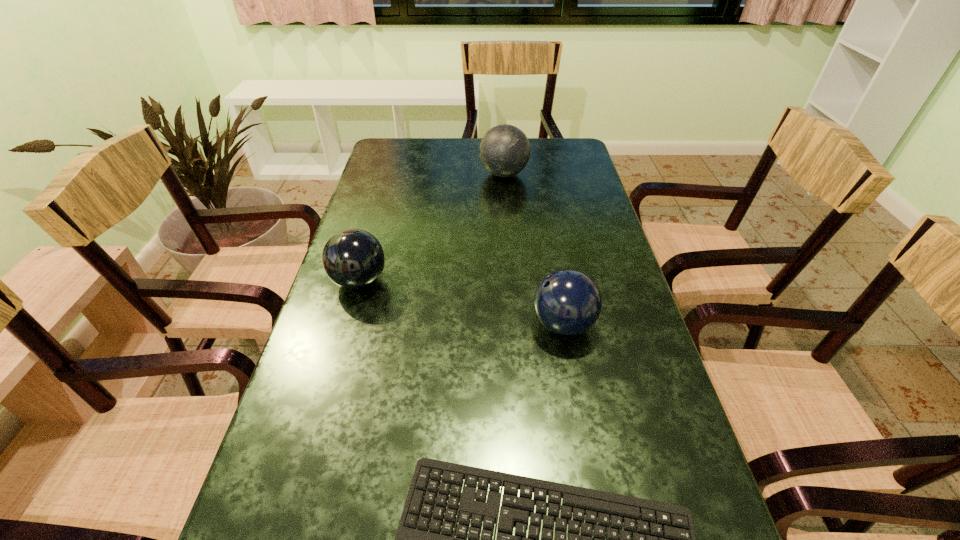
Find the location of a particular element. empty location between the farthest bowling ball and the second nearest object is located at coordinates (534, 249).

In order to click on free space between the farthest bowling ball and the second nearest object in this screenshot , I will do `click(534, 249)`.

At what (x,y) coordinates should I click in order to perform the action: click on vacant area that lies between the leftmost bowling ball and the farthest bowling ball. Please return your answer as a coordinate pair (x, y). Looking at the image, I should click on (432, 227).

You are a GUI agent. You are given a task and a screenshot of the screen. Output one action in this format:
    pyautogui.click(x=<x>, y=<y>)
    Task: Click on the object that can be found as the closest to the farthest bowling ball
    Image resolution: width=960 pixels, height=540 pixels.
    Given the screenshot: What is the action you would take?
    pyautogui.click(x=352, y=258)

Locate an element on the screen. This screenshot has height=540, width=960. the closest object to the nearest bowling ball is located at coordinates point(406,539).

You are a GUI agent. You are given a task and a screenshot of the screen. Output one action in this format:
    pyautogui.click(x=<x>, y=<y>)
    Task: Click on the second closest bowling ball to the farthest object
    The image size is (960, 540).
    Given the screenshot: What is the action you would take?
    pyautogui.click(x=567, y=302)

This screenshot has width=960, height=540. I want to click on bowling ball object that ranks as the third closest to the shortest object, so click(504, 151).